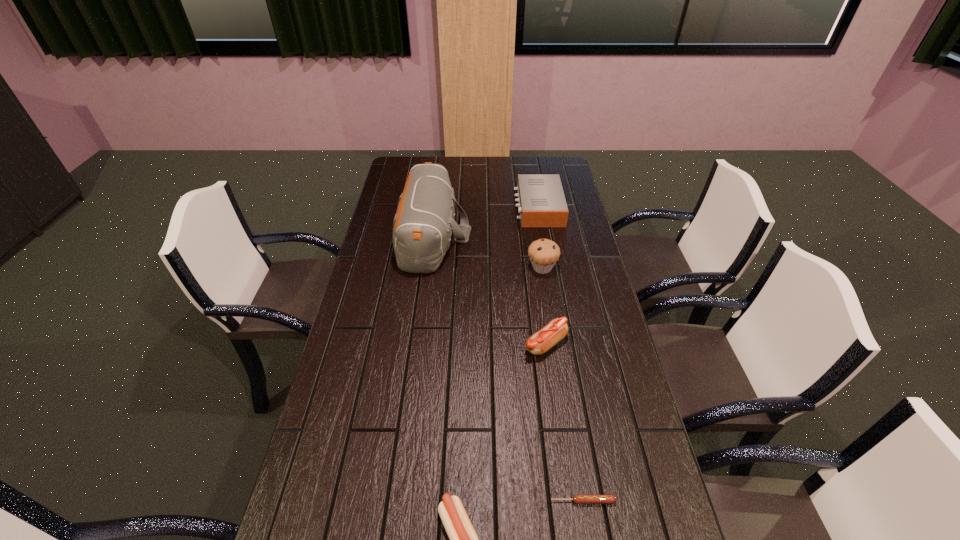
I want to click on vacant area situated 0.120m on the control panel of the radio receiver, so click(x=487, y=206).

Where is `free space located 0.150m on the front of the fourth farthest object`? Image resolution: width=960 pixels, height=540 pixels. free space located 0.150m on the front of the fourth farthest object is located at coordinates (555, 407).

Locate an element on the screen. This screenshot has height=540, width=960. free space located 0.090m on the back of the shortest object is located at coordinates click(576, 458).

The image size is (960, 540). Identify the location of object present at the left edge. click(x=423, y=224).

Where is `muffin at the right edge`? This screenshot has width=960, height=540. muffin at the right edge is located at coordinates (543, 253).

Locate an element on the screen. Image resolution: width=960 pixels, height=540 pixels. radio receiver that is at the right edge is located at coordinates (542, 203).

Image resolution: width=960 pixels, height=540 pixels. In the image, there is a desktop. In order to click on free space at the left edge in this screenshot , I will do `click(379, 287)`.

I want to click on free space at the right edge of the desktop, so click(x=646, y=444).

This screenshot has height=540, width=960. I want to click on free region at the far right corner, so click(559, 170).

The width and height of the screenshot is (960, 540). I want to click on empty location between the shortest object and the third nearest object, so click(564, 422).